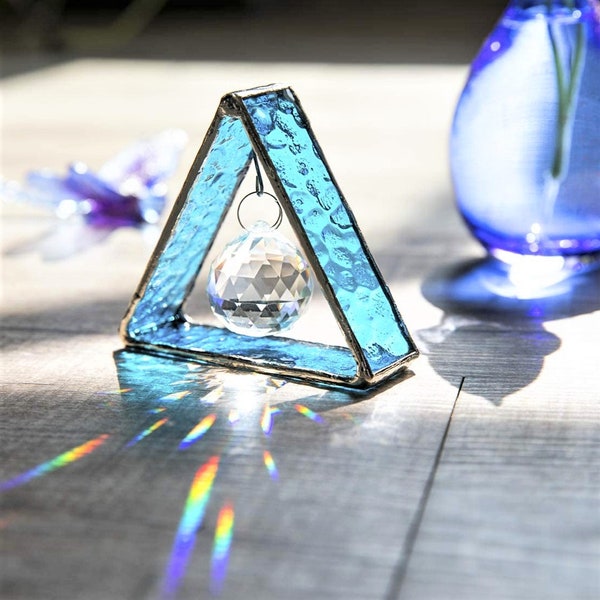
Identify the location of hook. (262, 190).